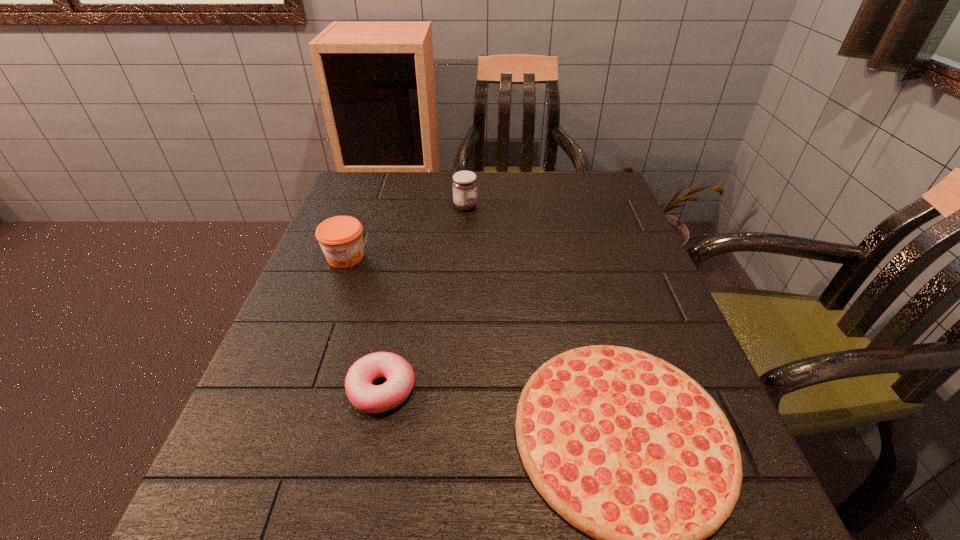
This screenshot has width=960, height=540. In order to click on the farthest object in this screenshot , I will do `click(464, 183)`.

This screenshot has height=540, width=960. Find the location of `the right jam`. the right jam is located at coordinates (464, 183).

At what (x,y) coordinates should I click in order to perform the action: click on the second farthest object. Please return your answer as a coordinate pair (x, y). Looking at the image, I should click on (341, 239).

I want to click on the left jam, so click(341, 239).

The image size is (960, 540). In order to click on doughnut in this screenshot , I will do `click(400, 376)`.

Locate an element on the screen. This screenshot has height=540, width=960. the third tallest object is located at coordinates (400, 376).

Locate an element on the screen. vacant region located 0.190m on the front label of the farthest object is located at coordinates (549, 207).

This screenshot has height=540, width=960. Identify the location of vacant area located 0.310m on the front label of the nearer jam. (297, 392).

Find the location of a particular element. vacant space located on the left of the third object from right to left is located at coordinates (300, 389).

Find the location of `object that is at the far edge`. object that is at the far edge is located at coordinates (464, 183).